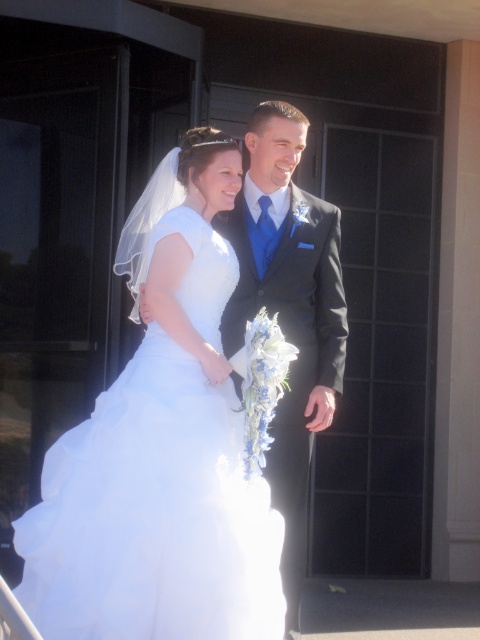
Does white satin dress at center have a lesser width compared to shiny black suit at center?

No.

Can you confirm if white satin dress at center is taller than shiny black suit at center?

Incorrect, white satin dress at center's height is not larger of shiny black suit at center's.

Which is in front, point (135, 440) or point (310, 428)?

Point (135, 440) is in front.

Where is `white satin dress at center`? This screenshot has width=480, height=640. white satin dress at center is located at coordinates (160, 448).